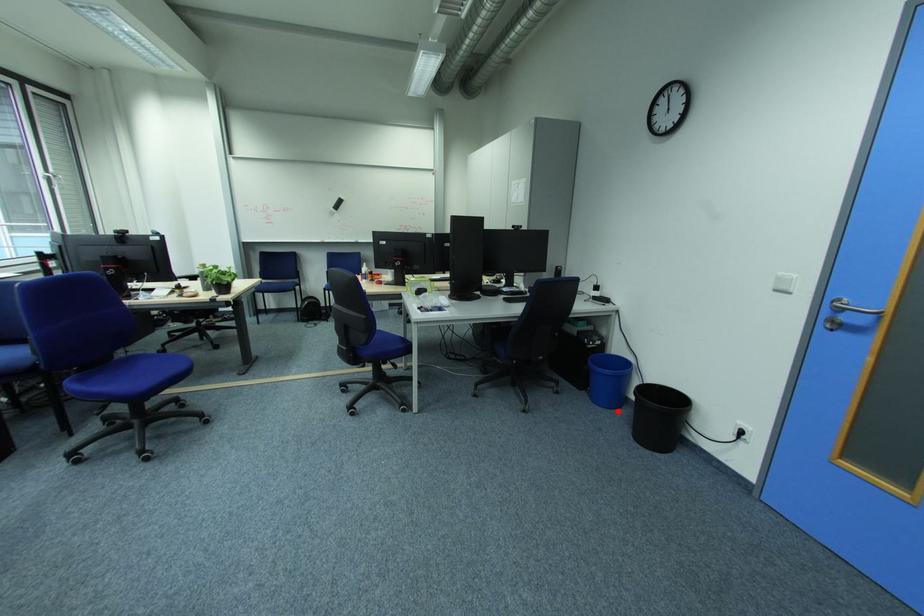
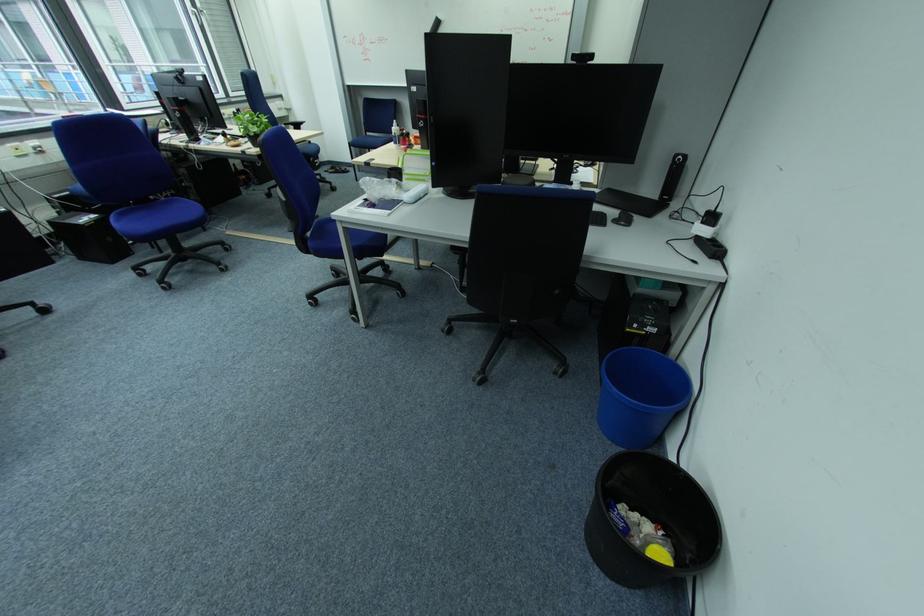
Question: A red point is marked in image1. In image2, is the corresponding 3D point closer to the camera or farther? Reply with the corresponding letter.

Choices:
 (A) The corresponding 3D point is closer.
 (B) The corresponding 3D point is farther.

Answer: (B)